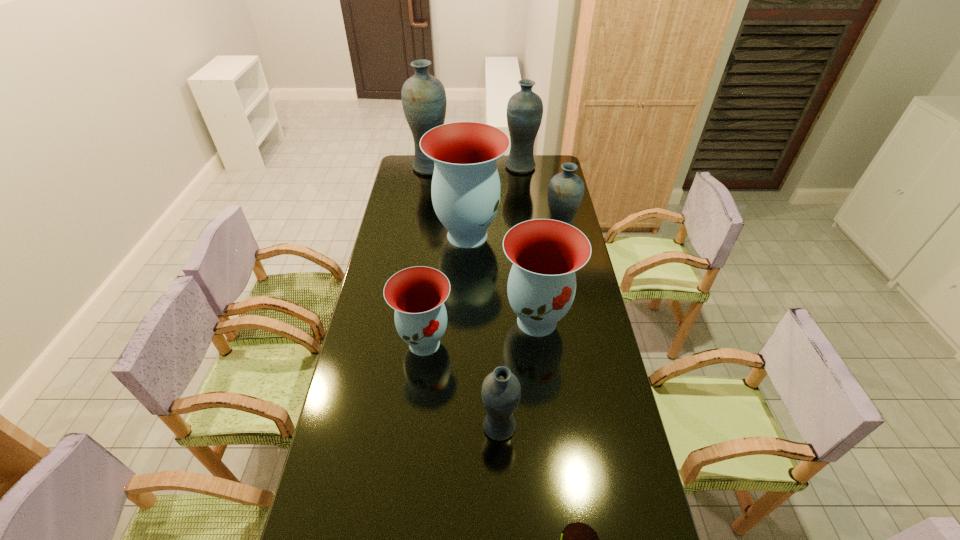
The image size is (960, 540). Identify the location of vacant space located on the left of the third smallest blue vase. (454, 166).

At what (x,y) coordinates should I click in order to perform the action: click on vacant space located on the right of the biggest red vase. Please return your answer as a coordinate pair (x, y). Looking at the image, I should click on (530, 235).

At what (x,y) coordinates should I click in order to perform the action: click on free space located on the left of the second smallest blue vase. Please return your answer as a coordinate pair (x, y). Looking at the image, I should click on (456, 239).

You are a GUI agent. You are given a task and a screenshot of the screen. Output one action in this format:
    pyautogui.click(x=<x>, y=<y>)
    Task: Click on the free point located on the left of the second biggest red vase
    The width and height of the screenshot is (960, 540).
    Given the screenshot: What is the action you would take?
    pyautogui.click(x=422, y=321)

The height and width of the screenshot is (540, 960). What are the coordinates of `vacant point located 0.200m on the right of the smallest red vase` in the screenshot? It's located at (512, 343).

At what (x,y) coordinates should I click in order to perform the action: click on free region located on the right of the second nearest object. Please return your answer as a coordinate pair (x, y). Looking at the image, I should click on (540, 426).

Where is `object that is at the far left corner`? This screenshot has width=960, height=540. object that is at the far left corner is located at coordinates coord(424,101).

Identify the location of object present at the far right corner. (524, 112).

Find the location of a particular element. The height and width of the screenshot is (540, 960). free spot at the left edge of the desktop is located at coordinates (425, 198).

Locate an element on the screen. vacant point at the right edge is located at coordinates (536, 182).